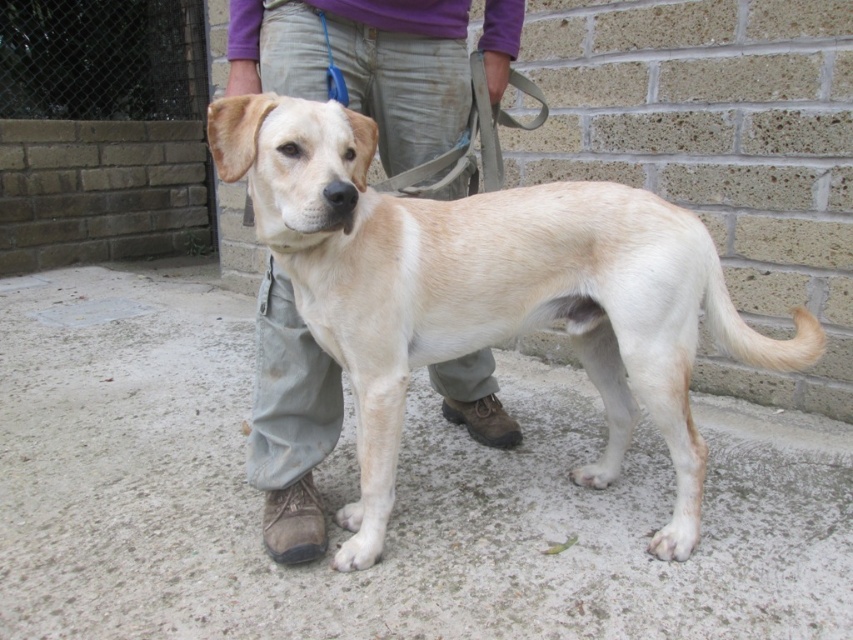
Does light beige fur at center have a smaller size compared to light beige pants at center?

Incorrect, light beige fur at center is not smaller in size than light beige pants at center.

Does point (366, 163) lie behind point (329, 397)?

No, it is in front of (329, 397).

You are a GUI agent. You are given a task and a screenshot of the screen. Output one action in this format:
    pyautogui.click(x=<x>, y=<y>)
    Task: Click on the light beige fur at center
    The height and width of the screenshot is (640, 853).
    Given the screenshot: What is the action you would take?
    pos(485,291)